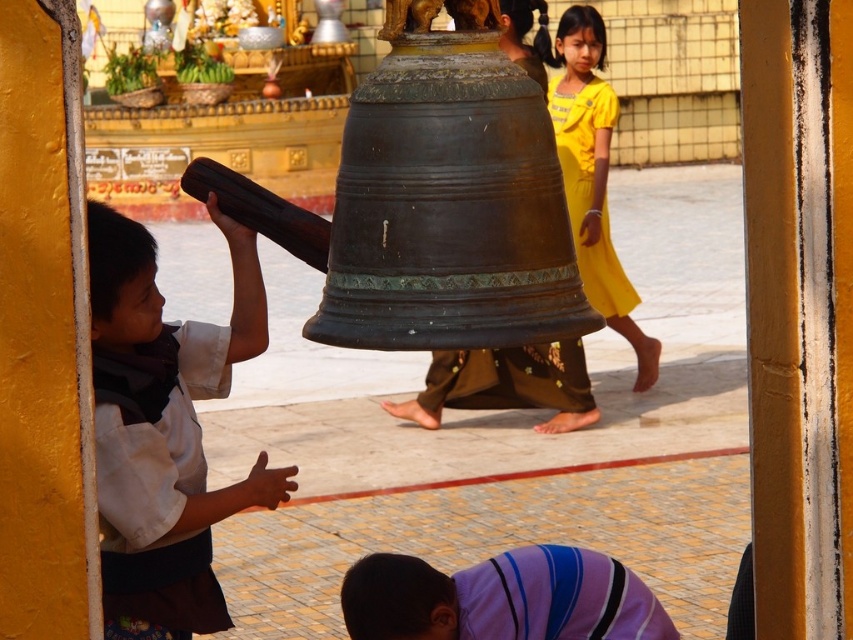
You are a visitor at this temple and want to take a photo of both the purple striped robe at lower center and the bronze bell at center in the same frame. Considering their distance, can you fit both in your camera viewfinder without moving your position?

The purple striped robe at lower center and bronze bell at center are 21.81 meters apart from each other. Since the distance between them is quite large, it might be challenging to capture both in a single frame without moving your position unless you have a wide angle lens.

You are a visitor at this temple and want to take a photo of the bronze bell at center without the purple striped robe at lower center appearing in the frame. How should you adjust your camera angle?

To avoid capturing the purple striped robe at lower center in the photo, you should position your camera higher so that the bronze bell at center is framed above the robe, as the robe is located below the bell.

You are a photographer at the temple scene. You want to capture a photo where both the white cotton shirt at left and the bronze bell at center are visible. Based on their positions, which object should you ensure is placed closer to the left edge of your camera frame?

The white cotton shirt at left is positioned on the left side of bronze bell at center, so to include both in the photo, the white cotton shirt at left should be placed closer to the left edge of the camera frame.